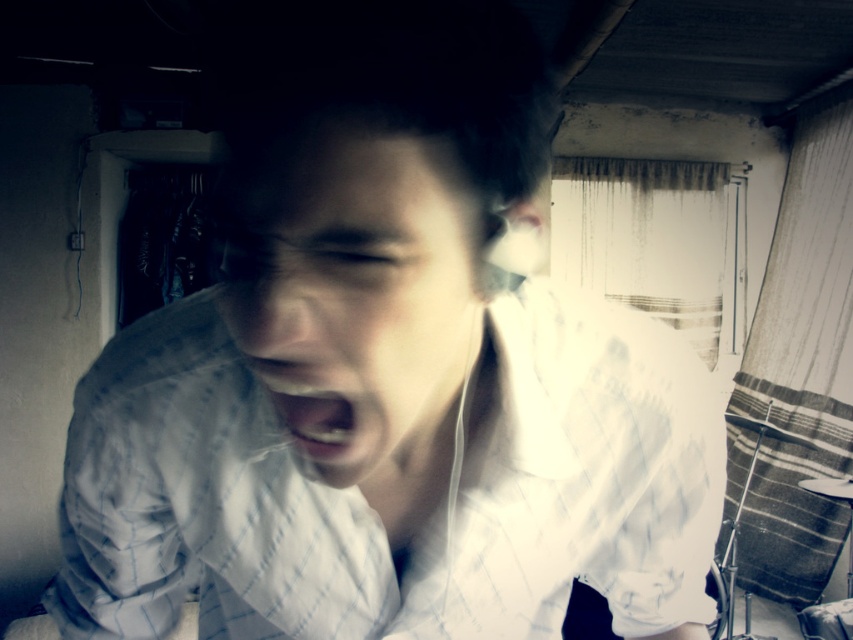
Consider the image. Is matte white earphones at center in front of white glossy teeth at center?

Yes, it is in front of white glossy teeth at center.

How distant is matte white earphones at center from white glossy teeth at center?

matte white earphones at center is 1.92 inches away from white glossy teeth at center.

I want to click on matte white earphones at center, so click(358, 298).

Image resolution: width=853 pixels, height=640 pixels. What are the coordinates of `matte white earphones at center` in the screenshot? It's located at (358, 298).